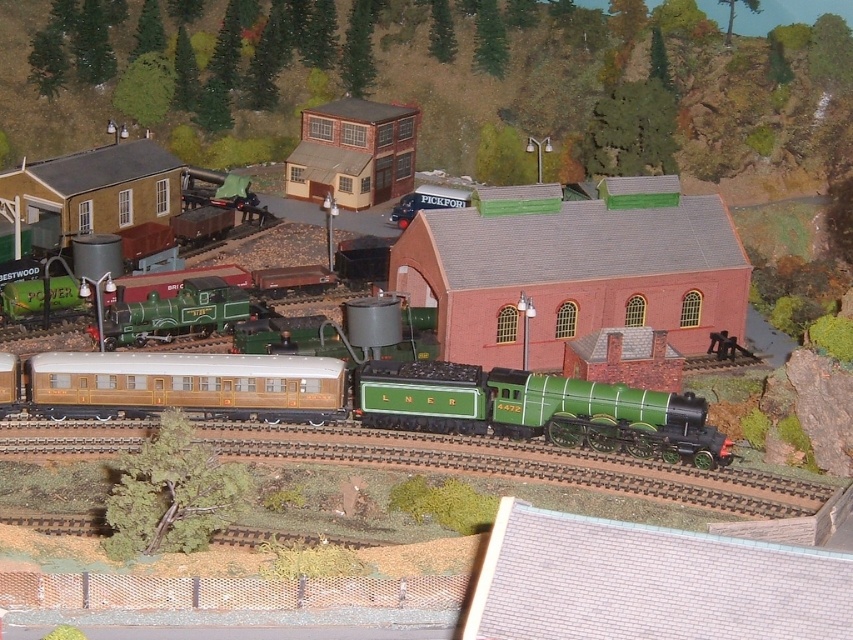
You are a model railway enthusiast examining the diorama. You notice the green metal train track at center and the matte gold passenger car at center. Which object has a greater width?

The green metal train track at center has a greater width than the matte gold passenger car at center according to the description.

You are a model railway enthusiast inspecting the layout. You notice the matte green locomotive at center and the green metal train track at center. Which object is closer to you?

The matte green locomotive at center is closer to you because the green metal train track at center is positioned behind it.

You are a model train enthusiast examining the layout of the model railway scene. You notice a point marked at coordinates [537,410]. Which object in the scene does this point correspond to?

The point at coordinates [537,410] corresponds to the matte green locomotive at center.